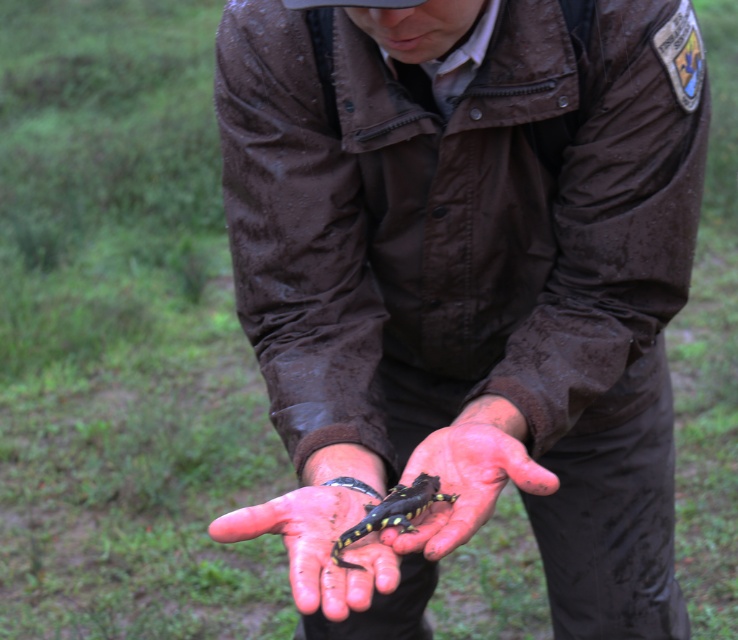
You are a wildlife researcher who just found a salamander in the forest. You need to place it in a container for transport. The container has a lid with a small opening at the top. Where should you place the container so that the opening faces away from the brown leather jacket at center?

Place the container so that the opening faces away from the brown leather jacket at center, which is located at point (x=466, y=285). This ensures the opening is directed away from the jacket.

You are a park visitor who notices a wildlife officer in the distance. You see the brown leather jacket at center and the yellow spotted lizard at center. Which object is closer to you?

The brown leather jacket at center is closer to you because the yellow spotted lizard at center is behind it.

Consider the image. You are a wildlife researcher who needs to determine if the yellow spotted lizard at center can fit entirely within the smooth skin hand at center. Based on the image, can it?

The yellow spotted lizard at center has a larger size compared to smooth skin hand at center, so it cannot fit entirely within the smooth skin hand at center.